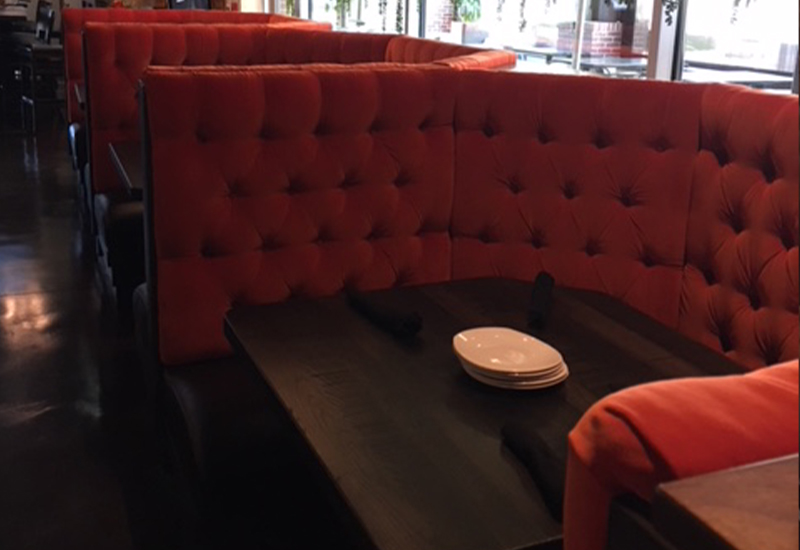
Where is `wood tables`? This screenshot has height=550, width=800. wood tables is located at coordinates (354, 362), (129, 179), (80, 92).